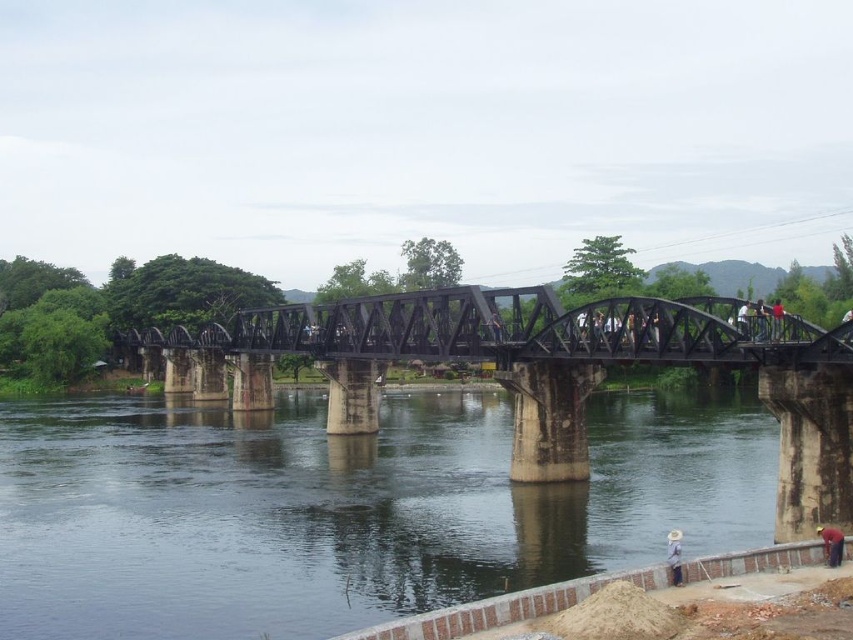
From the picture: You are observing a construction site near a truss bridge. You notice two workers wearing different colored shirts. The first is a red matte shirt at lower right, and the second is a light blue shirt at upper right. Which worker appears closer to you based on their position?

The red matte shirt at lower right appears closer because it has a lesser height compared to the light blue shirt at upper right, indicating it is positioned lower in the visual field and thus nearer to the observer.

You are a drone operator who needs to fly a drone under the black metal bridge at center. From the clear water at bridge lower, how does the height of the bridge compare to the water?

The black metal bridge at center has a greater height than the clear water at bridge lower, so the drone can safely pass under it.

You are a photographer positioned on the truss bridge and want to capture both the red matte shirt at lower right and the gray fabric hat at lower right in the same frame. Which object should you adjust your camera to focus on first to ensure both are in the shot?

You should focus on the gray fabric hat at lower right first because the red matte shirt at lower right is positioned to its right. By centering the gray fabric hat at lower right in your viewfinder, you can pan slightly to the right to include the red matte shirt at lower right without losing the hat from the frame.